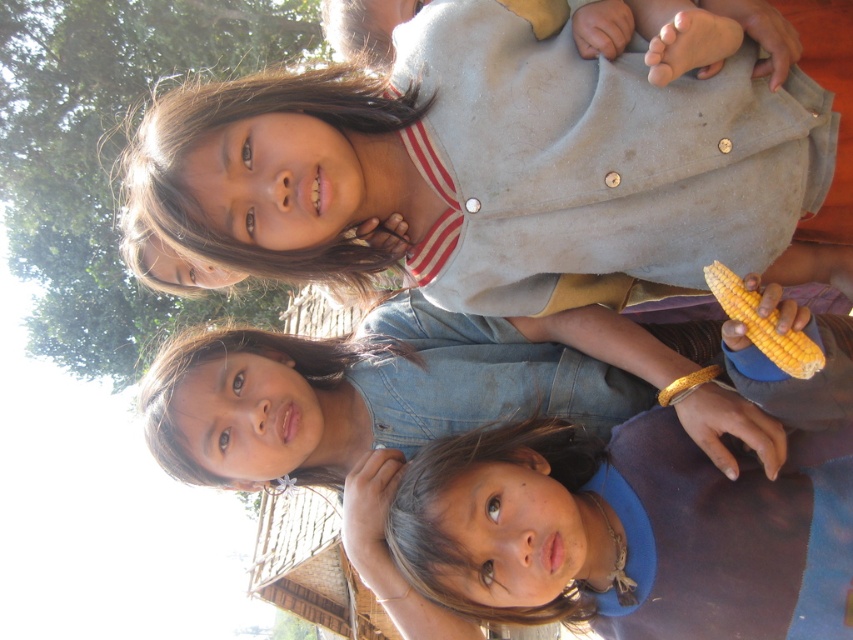
Is matte gray shirt at upper center shorter than yellow matte corn at right?

No, matte gray shirt at upper center is not shorter than yellow matte corn at right.

Which is in front, point (357, 81) or point (734, 280)?

Point (734, 280)

Where is `matte gray shirt at upper center`? This screenshot has width=853, height=640. matte gray shirt at upper center is located at coordinates (480, 168).